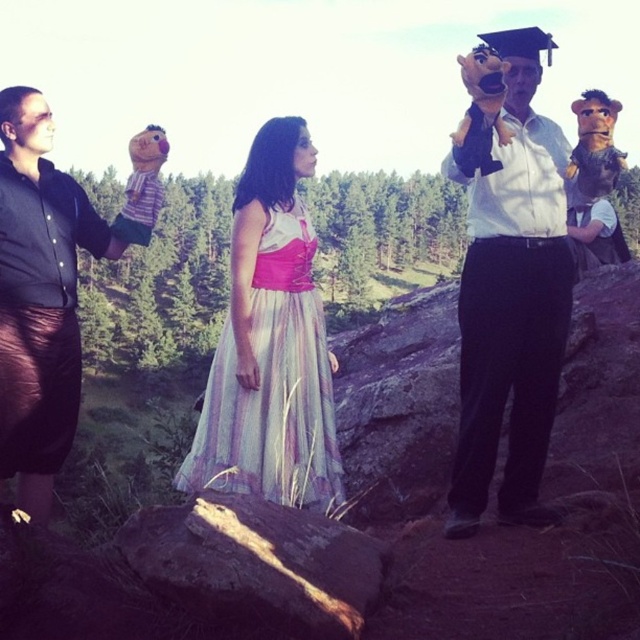
Can you confirm if matte black glove at left is bigger than rusty metallic log at center?

Yes.

Which is behind, point (3, 356) or point (186, 531)?

The point (3, 356) is behind.

Which is in front, point (45, 438) or point (291, 561)?

Positioned in front is point (291, 561).

Find the location of a particular element. Image resolution: width=640 pixels, height=640 pixels. matte black glove at left is located at coordinates (42, 296).

Is pastel chiffon dress at center above rusty metallic log at center?

Correct, pastel chiffon dress at center is located above rusty metallic log at center.

Is pastel chiffon dress at center in front of rusty metallic log at center?

No, pastel chiffon dress at center is further to the viewer.

Identify the location of pastel chiffon dress at center. Image resolution: width=640 pixels, height=640 pixels. (273, 385).

Who is taller, white shirt at center or rusty metallic log at center?

With more height is white shirt at center.

In the scene shown: Does white shirt at center appear on the right side of rusty metallic log at center?

Yes, white shirt at center is to the right of rusty metallic log at center.

You are a GUI agent. You are given a task and a screenshot of the screen. Output one action in this format:
    pyautogui.click(x=<x>, y=<y>)
    Task: Click on the white shirt at center
    The image size is (640, 640).
    Given the screenshot: What is the action you would take?
    pyautogui.click(x=508, y=284)